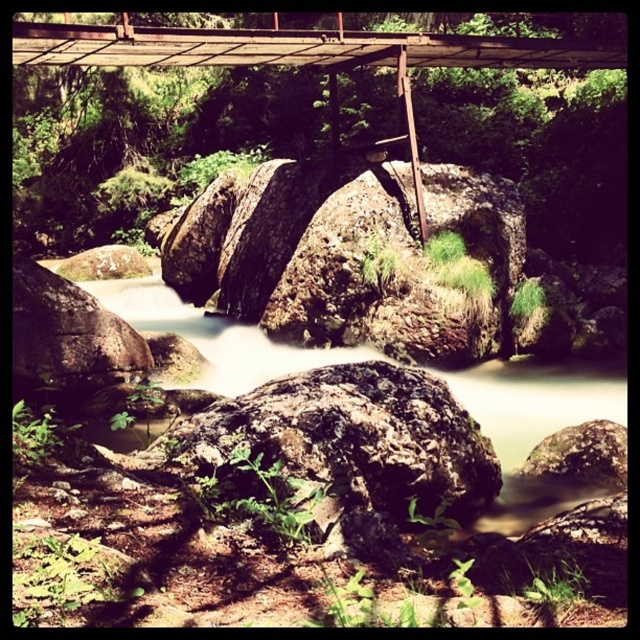
Question: Is brown rock at center smaller than rusty metal bridge at upper center?

Choices:
 (A) no
 (B) yes

Answer: (A)

Question: Among these points, which one is farthest from the camera?

Choices:
 (A) (493, 506)
 (B) (262, 56)

Answer: (B)

Question: Is brown rock at center smaller than rusty metal bridge at upper center?

Choices:
 (A) no
 (B) yes

Answer: (A)

Question: Which point appears closest to the camera in this image?

Choices:
 (A) (150, 64)
 (B) (500, 468)

Answer: (B)

Question: Which object is closer to the camera taking this photo?

Choices:
 (A) brown rock at center
 (B) rusty metal bridge at upper center

Answer: (A)

Question: Is brown rock at center below rusty metal bridge at upper center?

Choices:
 (A) yes
 (B) no

Answer: (A)